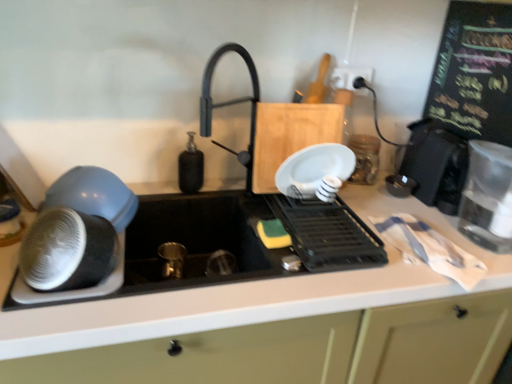
This screenshot has height=384, width=512. I want to click on free space to the left of clear glass water at right, the 2th kitchen appliance positioned from the left, so click(x=437, y=238).